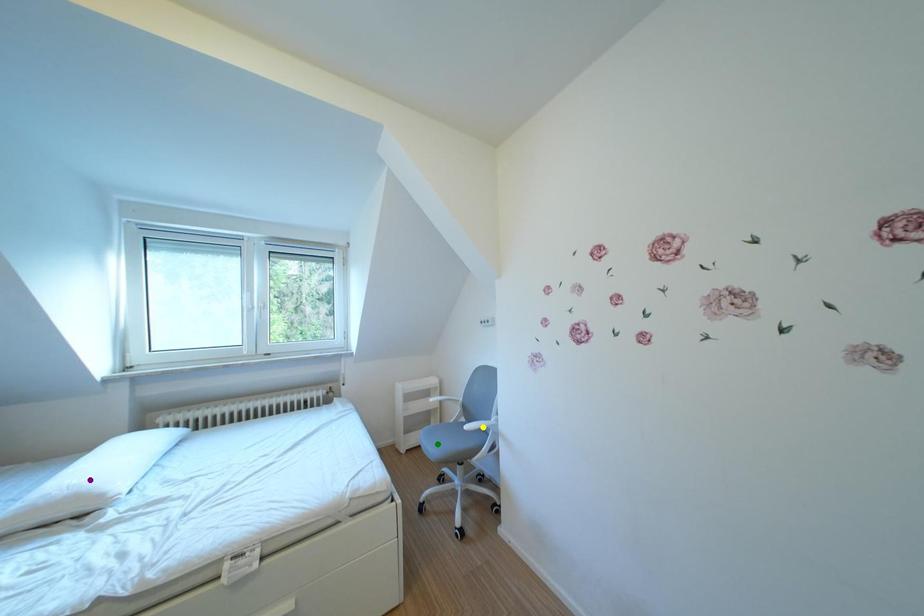
Order these from nearest to farthest:
yellow point | green point | purple point

purple point < yellow point < green point